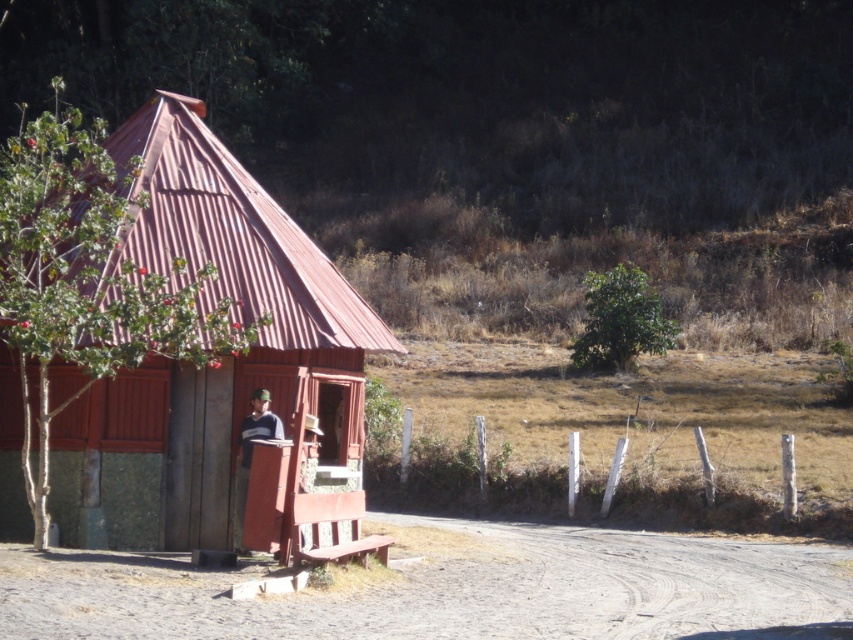
You are standing at the point marked by the coordinates point (x=207, y=365). What object are you directly in front of?

The point (x=207, y=365) marks rustic wood cabin at left, so you are directly in front of the rustic wood cabin at left.

You are standing at the dirt track at lower center and want to walk towards the rustic wood cabin at left. Which direction should you move to get closer to the cabin?

Since the rustic wood cabin at left is further to the viewer than the dirt track at lower center, you should move forward along the dirt track at lower center towards the cabin.

You are standing at the entrance of the rustic wood cabin at left and want to walk to the dirt track at lower center. Which direction should you head towards?

You should head towards the dirt track at lower center, which is to the right of the rustic wood cabin at left since the cabin is shorter than the dirt track.